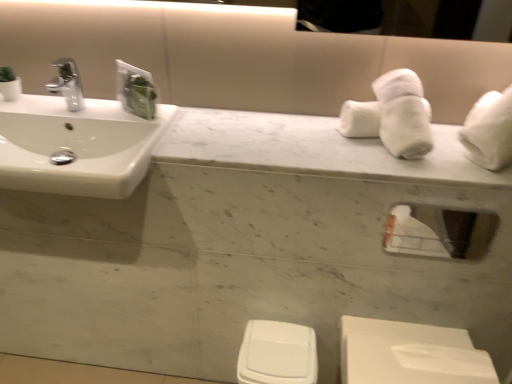
Find the location of a particular element. This screenshot has width=512, height=384. vacant space situated above white glossy toilet at lower right (from a real-world perspective) is located at coordinates click(x=411, y=360).